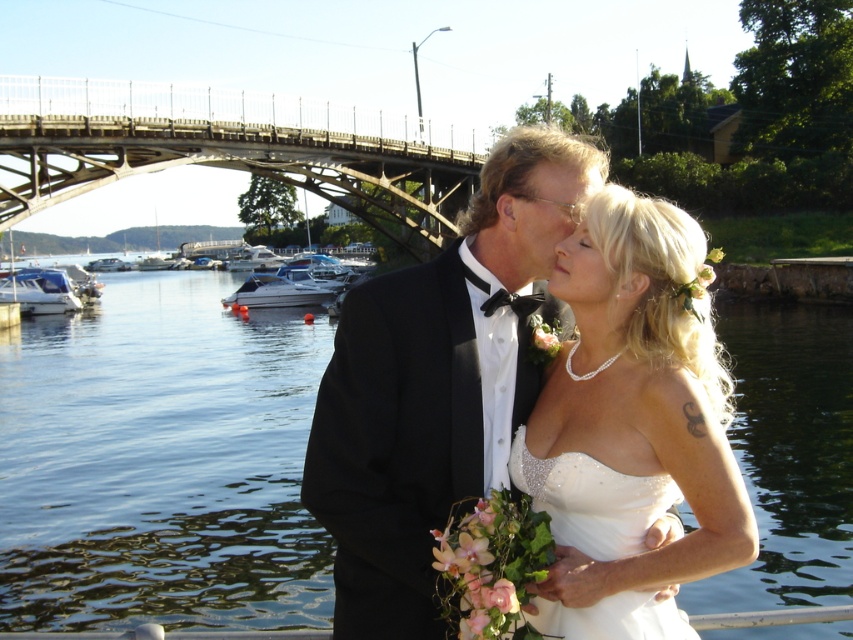
Which is more to the right, clear water at center or metallic bridge at upper center?

From the viewer's perspective, metallic bridge at upper center appears more on the right side.

Is clear water at center positioned in front of metallic bridge at upper center?

Yes, clear water at center is closer to the viewer.

Find the location of `clear water at center`. clear water at center is located at coordinates coord(160,464).

Is white satin dress at center above matte black hair at upper center?

Incorrect, white satin dress at center is not positioned above matte black hair at upper center.

I want to click on white satin dress at center, so click(631, 426).

Does black satin tuxedo at center appear over matte black hair at upper center?

Yes.

Is black satin tuxedo at center further to camera compared to matte black hair at upper center?

No.

Where is `black satin tuxedo at center`? black satin tuxedo at center is located at coordinates (431, 390).

What are the coordinates of `black satin tuxedo at center` in the screenshot? It's located at (431, 390).